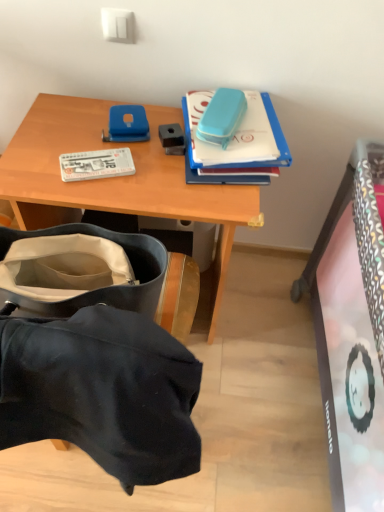
Locate an element on the screen. wooden desk at upper center is located at coordinates (115, 177).

Where is `white matte book at left, the 2th book viewed from the right`? white matte book at left, the 2th book viewed from the right is located at coordinates (96, 164).

The height and width of the screenshot is (512, 384). Find the location of `wooden desk at upper center`. wooden desk at upper center is located at coordinates (115, 177).

How much distance is there between blue matte case at upper right, arranged as the second book when viewed from the left, and dark blue fabric bag at lower left?

blue matte case at upper right, arranged as the second book when viewed from the left, is 15.55 inches from dark blue fabric bag at lower left.

How many degrees apart are the facing directions of blue matte case at upper right, arranged as the second book when viewed from the left, and dark blue fabric bag at lower left?

blue matte case at upper right, arranged as the second book when viewed from the left, and dark blue fabric bag at lower left are facing 173 degrees away from each other.

Who is bigger, blue matte case at upper right, arranged as the second book when viewed from the left, or dark blue fabric bag at lower left?

Bigger between the two is dark blue fabric bag at lower left.

Is blue matte case at upper right, arranged as the second book when viewed from the left, wider than dark blue fabric bag at lower left?

Yes.

Are dark blue fabric bag at lower left and blue matte case at upper right, the first book when ordered from right to left, far apart?

dark blue fabric bag at lower left is actually quite close to blue matte case at upper right, the first book when ordered from right to left.

From the image's perspective, between dark blue fabric bag at lower left and blue matte case at upper right, arranged as the second book when viewed from the left, which one is located above?

blue matte case at upper right, arranged as the second book when viewed from the left, is shown above in the image.

I want to click on luggage and bags below the blue matte case at upper right, the first book when ordered from right to left (from the image's perspective), so click(102, 287).

Is white matte book at left, the 1th book when ordered from left to right, not inside blue matte case at upper right, arranged as the second book when viewed from the left?

Yes.

Does white matte book at left, the 1th book when ordered from left to right, turn towards blue matte case at upper right, arranged as the second book when viewed from the left?

Yes, white matte book at left, the 1th book when ordered from left to right, faces towards blue matte case at upper right, arranged as the second book when viewed from the left.

Does white matte book at left, the 2th book viewed from the right, have a lesser width compared to blue matte case at upper right, arranged as the second book when viewed from the left?

Yes.

In the scene shown: Which object is further away from the camera taking this photo, white matte book at left, the 2th book viewed from the right, or blue matte case at upper right, arranged as the second book when viewed from the left?

white matte book at left, the 2th book viewed from the right, is behind.

Which is behind, point (98, 227) or point (64, 169)?

The point (64, 169) is farther.

Which object is positioned more to the right, dark blue fabric bag at lower left or white matte book at left, the 1th book when ordered from left to right?

From the viewer's perspective, dark blue fabric bag at lower left appears more on the right side.

Where is `book to the left of dark blue fabric bag at lower left`? book to the left of dark blue fabric bag at lower left is located at coordinates (96, 164).

Would you say dark blue fabric bag at lower left is a long distance from white matte book at left, the 1th book when ordered from left to right?

No.

Considering the positions of objects white matte book at left, the 2th book viewed from the right, and wooden desk at upper center in the image provided, who is more to the right, white matte book at left, the 2th book viewed from the right, or wooden desk at upper center?

From the viewer's perspective, wooden desk at upper center appears more on the right side.

From the picture: Which is closer, (110,165) or (37,117)?

Clearly, point (110,165) is closer to the camera than point (37,117).

Considering the sizes of white matte book at left, the 2th book viewed from the right, and wooden desk at upper center in the image, is white matte book at left, the 2th book viewed from the right, bigger or smaller than wooden desk at upper center?

white matte book at left, the 2th book viewed from the right, is smaller than wooden desk at upper center.

Is white matte book at left, the 2th book viewed from the right, taller or shorter than wooden desk at upper center?

In the image, white matte book at left, the 2th book viewed from the right, appears to be shorter than wooden desk at upper center.

Locate an element on the screen. The height and width of the screenshot is (512, 384). luggage and bags on the left of wooden desk at upper center is located at coordinates (102, 287).

Is wooden desk at upper center thinner than dark blue fabric bag at lower left?

In fact, wooden desk at upper center might be wider than dark blue fabric bag at lower left.

Consider the image. From the image's perspective, is wooden desk at upper center located beneath dark blue fabric bag at lower left?

Incorrect, from the image's perspective, wooden desk at upper center is higher than dark blue fabric bag at lower left.

Can you tell me how much dark blue fabric bag at lower left and wooden desk at upper center differ in facing direction?

There is a 179-degree angle between the facing directions of dark blue fabric bag at lower left and wooden desk at upper center.

The width and height of the screenshot is (384, 512). I want to click on desk above the dark blue fabric bag at lower left (from the image's perspective), so click(115, 177).

Visually, is dark blue fabric bag at lower left positioned to the left or to the right of wooden desk at upper center?

dark blue fabric bag at lower left is positioned on wooden desk at upper center's left side.

Is dark blue fabric bag at lower left oriented away from wooden desk at upper center?

That's not correct — dark blue fabric bag at lower left is not looking away from wooden desk at upper center.

This screenshot has width=384, height=512. I want to click on luggage and bags that is under the blue matte case at upper right, the first book when ordered from right to left (from a real-world perspective), so click(102, 287).

The height and width of the screenshot is (512, 384). In order to click on the 2nd book directly above the dark blue fabric bag at lower left (from a real-world perspective) in this screenshot , I will do `click(202, 165)`.

Based on their spatial positions, is white matte book at left, the 1th book when ordered from left to right, or dark blue fabric bag at lower left further from blue matte case at upper right, arranged as the second book when viewed from the left?

dark blue fabric bag at lower left.

Considering their positions, is blue matte case at upper right, the first book when ordered from right to left, positioned closer to wooden desk at upper center than white matte book at left, the 1th book when ordered from left to right?

white matte book at left, the 1th book when ordered from left to right.

Estimate the real-world distances between objects in this image. Which object is further from blue matte case at upper right, arranged as the second book when viewed from the left, dark blue fabric bag at lower left or white matte book at left, the 1th book when ordered from left to right?

Among the two, dark blue fabric bag at lower left is located further to blue matte case at upper right, arranged as the second book when viewed from the left.

Which object lies further to the anchor point wooden desk at upper center, dark blue fabric bag at lower left or blue matte case at upper right, the first book when ordered from right to left?

Among the two, dark blue fabric bag at lower left is located further to wooden desk at upper center.

Estimate the real-world distances between objects in this image. Which object is closer to wooden desk at upper center, blue matte case at upper right, arranged as the second book when viewed from the left, or dark blue fabric bag at lower left?

blue matte case at upper right, arranged as the second book when viewed from the left, is closer to wooden desk at upper center.

Based on the photo, from the image, which object appears to be nearer to blue matte case at upper right, the first book when ordered from right to left, white matte book at left, the 1th book when ordered from left to right, or wooden desk at upper center?

The object closer to blue matte case at upper right, the first book when ordered from right to left, is wooden desk at upper center.

Based on their spatial positions, is white matte book at left, the 2th book viewed from the right, or blue matte case at upper right, arranged as the second book when viewed from the left, further from dark blue fabric bag at lower left?

blue matte case at upper right, arranged as the second book when viewed from the left, lies further to dark blue fabric bag at lower left than the other object.

Which object lies further to the anchor point wooden desk at upper center, dark blue fabric bag at lower left or white matte book at left, the 1th book when ordered from left to right?

The object further to wooden desk at upper center is dark blue fabric bag at lower left.

Where is `desk positioned between dark blue fabric bag at lower left and white matte book at left, the 1th book when ordered from left to right, from near to far`? The image size is (384, 512). desk positioned between dark blue fabric bag at lower left and white matte book at left, the 1th book when ordered from left to right, from near to far is located at coordinates (115, 177).

Locate an element on the screen. The image size is (384, 512). book located between dark blue fabric bag at lower left and white matte book at left, the 2th book viewed from the right, in the depth direction is located at coordinates (202, 165).

The height and width of the screenshot is (512, 384). In order to click on desk between dark blue fabric bag at lower left and blue matte case at upper right, arranged as the second book when viewed from the left, from front to back in this screenshot , I will do `click(115, 177)`.

The image size is (384, 512). In order to click on desk between white matte book at left, the 1th book when ordered from left to right, and blue matte case at upper right, the first book when ordered from right to left, from left to right in this screenshot , I will do `click(115, 177)`.